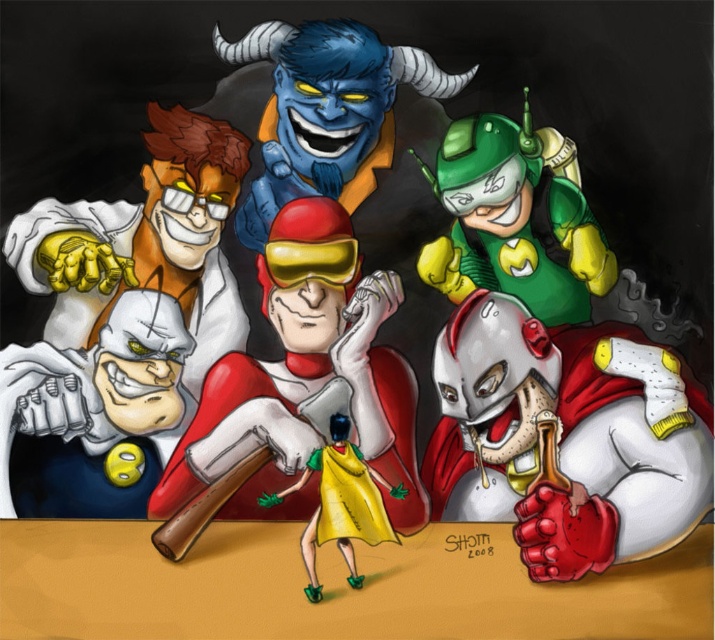
You are designing a stage for a play and need to place the green matte robot at upper right and the yellow matte cape at center. Based on their sizes, which object requires more horizontal space on the stage?

The green matte robot at upper right might require more horizontal space on the stage since it might be wider than the yellow matte cape at center.

You are a game character trying to reach a treasure chest located at the center of the scene. There is a blue rubber demon at upper center and a yellow matte cape at center blocking your path. Which obstacle is bigger and requires more careful navigation?

The blue rubber demon at upper center is larger in size compared to the yellow matte cape at center, so it requires more careful navigation.

You are a character in the image and want to grab the yellow matte cape at center without touching the blue rubber demon at upper center. Is it possible?

The yellow matte cape at center is behind the blue rubber demon at upper center, so you can reach around the demon to grab the yellow matte cape at center without touching it.